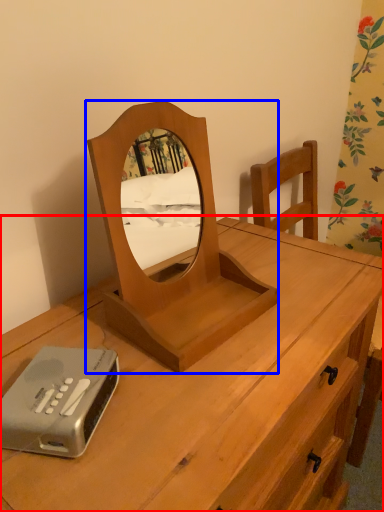
Question: Which of the following is the closest to the observer, desk (highlighted by a red box) or mirror (highlighted by a blue box)?

Choices:
 (A) desk
 (B) mirror

Answer: (A)